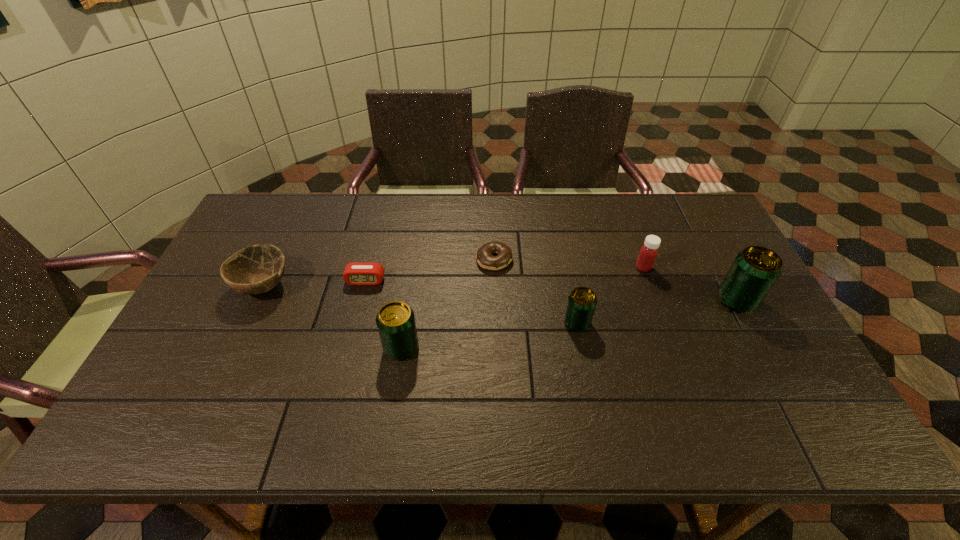
In order to click on free point that keeps the beer cans evenly spaced on the left in this screenshot , I will do `click(208, 375)`.